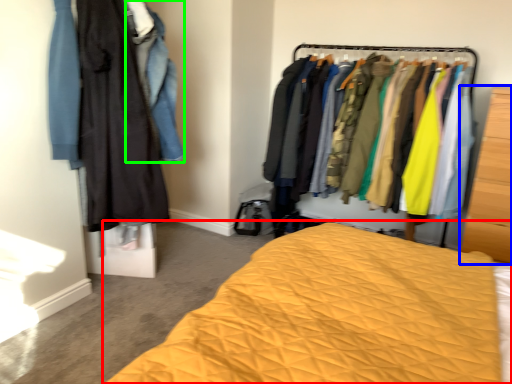
Question: Which object is the farthest from bed (highlighted by a red box)? Choose among these: furniture (highlighted by a blue box) or clothing (highlighted by a green box).

Choices:
 (A) furniture
 (B) clothing

Answer: (A)